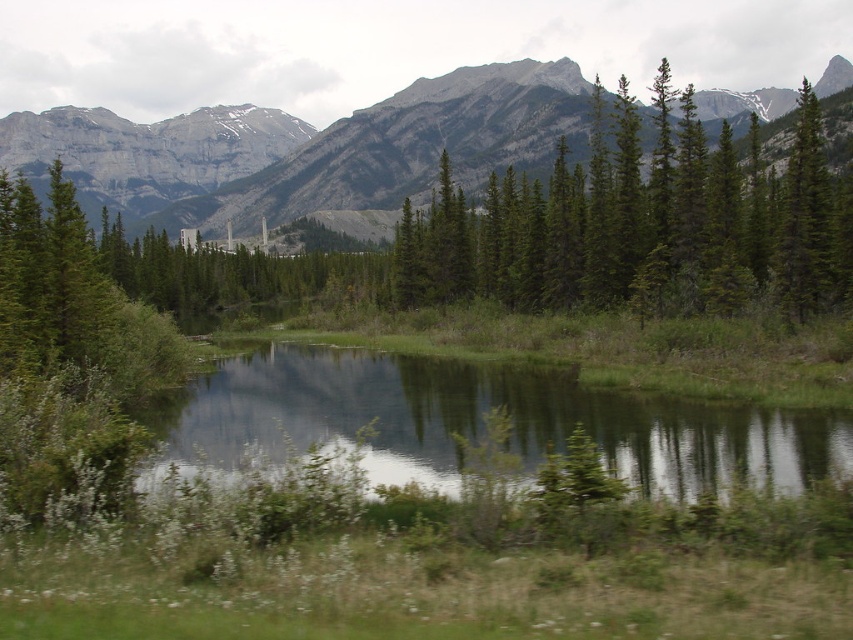
Question: Among these objects, which one is farthest from the camera?

Choices:
 (A) green grassy pond at center
 (B) green textured trees at upper right

Answer: (B)

Question: Can you confirm if green textured trees at upper right is positioned below green grassy pond at center?

Choices:
 (A) yes
 (B) no

Answer: (B)

Question: Among these points, which one is nearest to the camera?

Choices:
 (A) (335, 385)
 (B) (137, 160)

Answer: (A)

Question: Does green textured trees at upper right appear on the left side of green grassy pond at center?

Choices:
 (A) no
 (B) yes

Answer: (A)

Question: Which of the following is the farthest from the observer?

Choices:
 (A) gray rock mountain at upper center
 (B) green textured trees at upper right
 (C) green grassy pond at center

Answer: (A)

Question: Can you confirm if green grassy pond at center is positioned to the left of gray rock mountain at upper center?

Choices:
 (A) yes
 (B) no

Answer: (B)